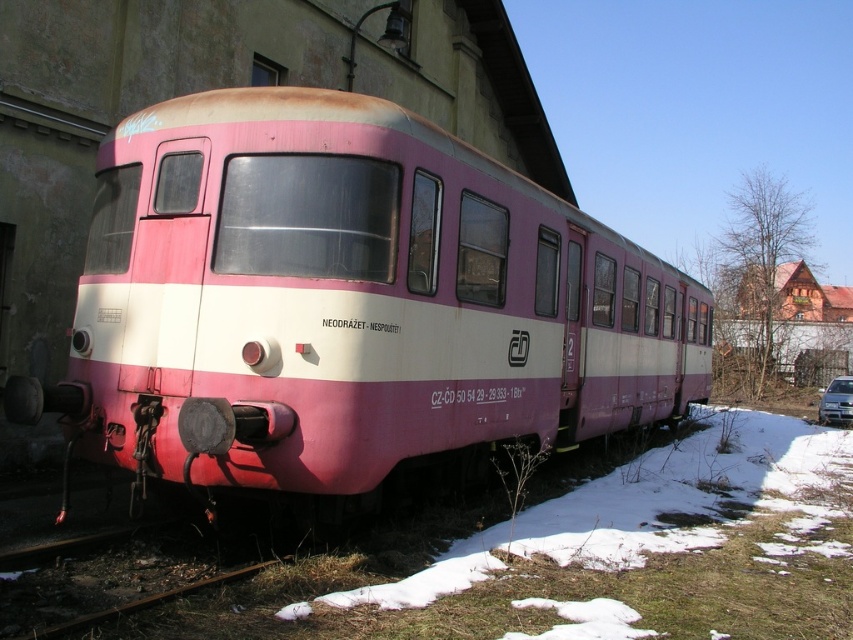
You are a pedestrian standing on the sidewalk and see the pink matte train at center and the metallic silver car at lower right. Which object is located to the left of the other?

The pink matte train at center is positioned on the left side of metallic silver car at lower right.

You are a pedestrian standing at the edge of the railway tracks. You see the pink matte train at center and the metallic silver car at lower right. Which object is closer to you?

The pink matte train at center is closer to you because it is positioned in front of the metallic silver car at lower right.

Looking at this image, you are a maintenance worker standing at the front of the pink matte train at center. You need to reach a tool box located 4.32 meters away from the train. Can you walk directly to the tool box without stepping off the railway tracks?

The tool box is 4.32 meters away from the pink matte train at center. Since the railway tracks are typically narrow, you can walk directly to the tool box without needing to step off the tracks.